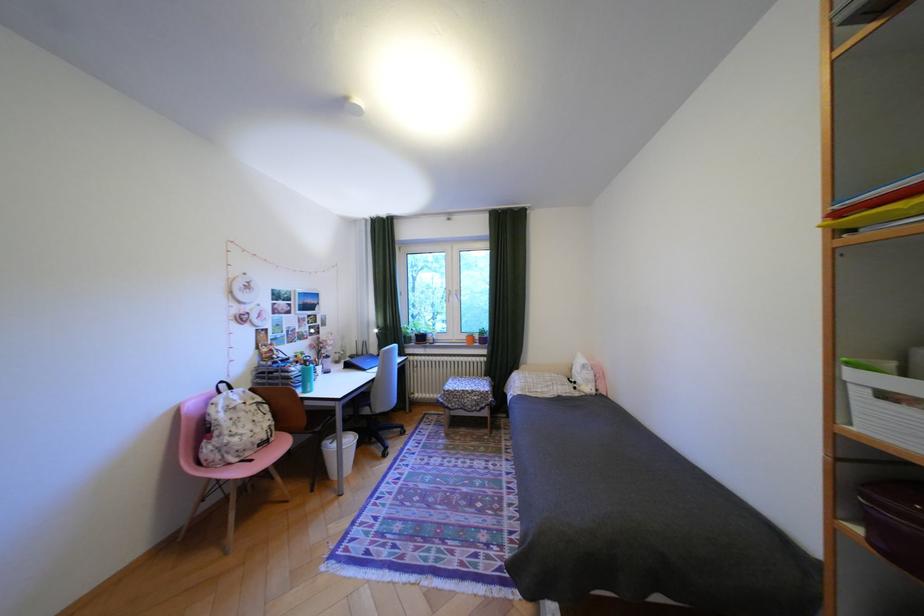
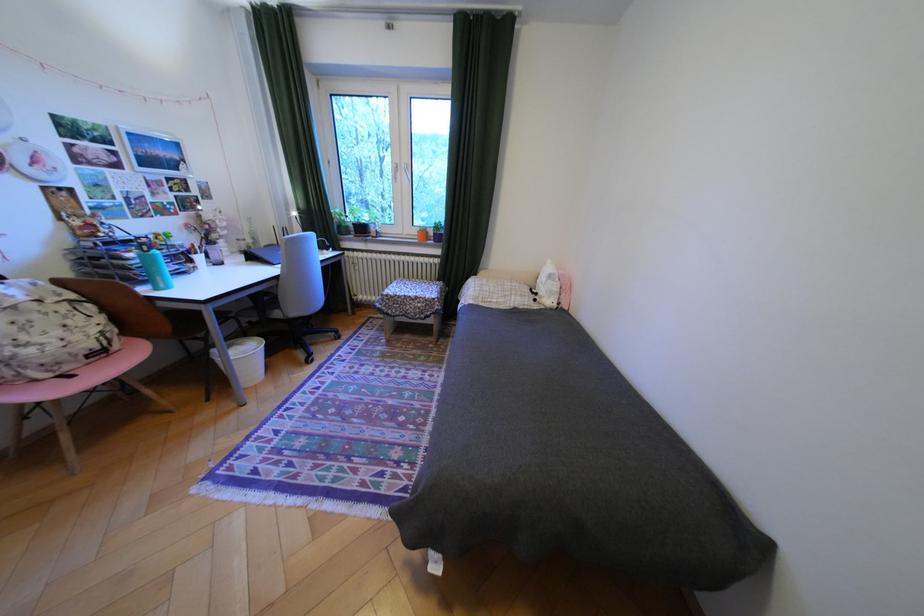
Question: How did the camera likely rotate?

Choices:
 (A) Left
 (B) Right
 (C) Up
 (D) Down

Answer: (D)